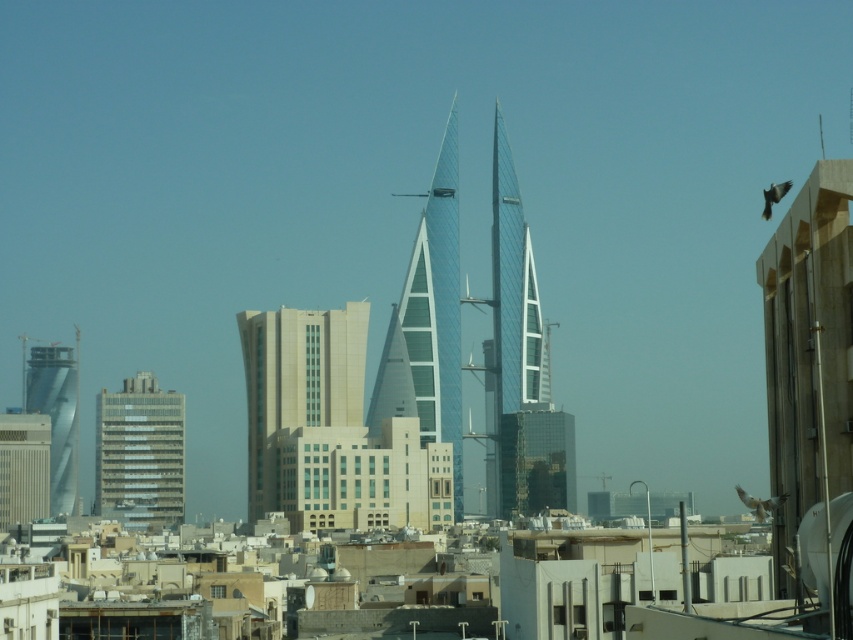
Question: Does glassy blue skyscraper at center appear over glassy reflective building at lower left?

Choices:
 (A) no
 (B) yes

Answer: (B)

Question: Does glassy reflective building at lower left appear on the left side of matte gray building at lower left?

Choices:
 (A) no
 (B) yes

Answer: (A)

Question: Can you confirm if glassy blue skyscraper at center is positioned to the right of glassy reflective building at lower left?

Choices:
 (A) no
 (B) yes

Answer: (B)

Question: Which object appears farthest from the camera in this image?

Choices:
 (A) glassy blue skyscraper at center
 (B) matte gray building at lower left
 (C) glassy reflective building at lower left
 (D) beige glass building at center

Answer: (B)

Question: Which of the following is the farthest from the observer?

Choices:
 (A) (4, 429)
 (B) (329, 316)

Answer: (A)

Question: Among these objects, which one is farthest from the camera?

Choices:
 (A) transparent glass skyscraper at center
 (B) beige glass building at center
 (C) glassy blue skyscraper at center
 (D) glassy reflective building at lower left

Answer: (D)